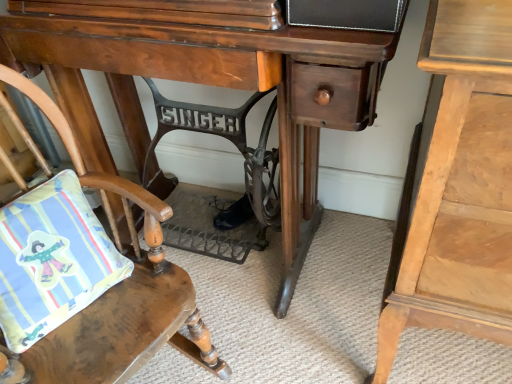
Question: Should I look upward or downward to see wooden cushioned chair at lower left?

Choices:
 (A) down
 (B) up

Answer: (A)

Question: Is matte cotton pillow at lower left surrounding wooden desk at center?

Choices:
 (A) yes
 (B) no

Answer: (B)

Question: Is there a large distance between matte cotton pillow at lower left and wooden desk at center?

Choices:
 (A) no
 (B) yes

Answer: (A)

Question: Is matte cotton pillow at lower left at the right side of wooden desk at center?

Choices:
 (A) yes
 (B) no

Answer: (B)

Question: From the image's perspective, is matte cotton pillow at lower left located beneath wooden desk at center?

Choices:
 (A) yes
 (B) no

Answer: (A)

Question: Is matte cotton pillow at lower left completely or partially outside of wooden desk at center?

Choices:
 (A) yes
 (B) no

Answer: (A)

Question: From a real-world perspective, is matte cotton pillow at lower left positioned under wooden desk at center based on gravity?

Choices:
 (A) yes
 (B) no

Answer: (B)

Question: Considering the relative sizes of matte cotton pillow at lower left and wooden cushioned chair at lower left in the image provided, is matte cotton pillow at lower left shorter than wooden cushioned chair at lower left?

Choices:
 (A) yes
 (B) no

Answer: (A)

Question: From the image's perspective, is matte cotton pillow at lower left under wooden cushioned chair at lower left?

Choices:
 (A) no
 (B) yes

Answer: (A)

Question: From the image's perspective, is matte cotton pillow at lower left on top of wooden cushioned chair at lower left?

Choices:
 (A) yes
 (B) no

Answer: (A)

Question: Is matte cotton pillow at lower left facing away from wooden cushioned chair at lower left?

Choices:
 (A) no
 (B) yes

Answer: (B)

Question: Is matte cotton pillow at lower left located outside wooden cushioned chair at lower left?

Choices:
 (A) no
 (B) yes

Answer: (A)

Question: Does matte cotton pillow at lower left lie behind wooden cushioned chair at lower left?

Choices:
 (A) no
 (B) yes

Answer: (B)

Question: From the image's perspective, does wooden desk at center appear lower than light wood nightstand at right?

Choices:
 (A) no
 (B) yes

Answer: (A)